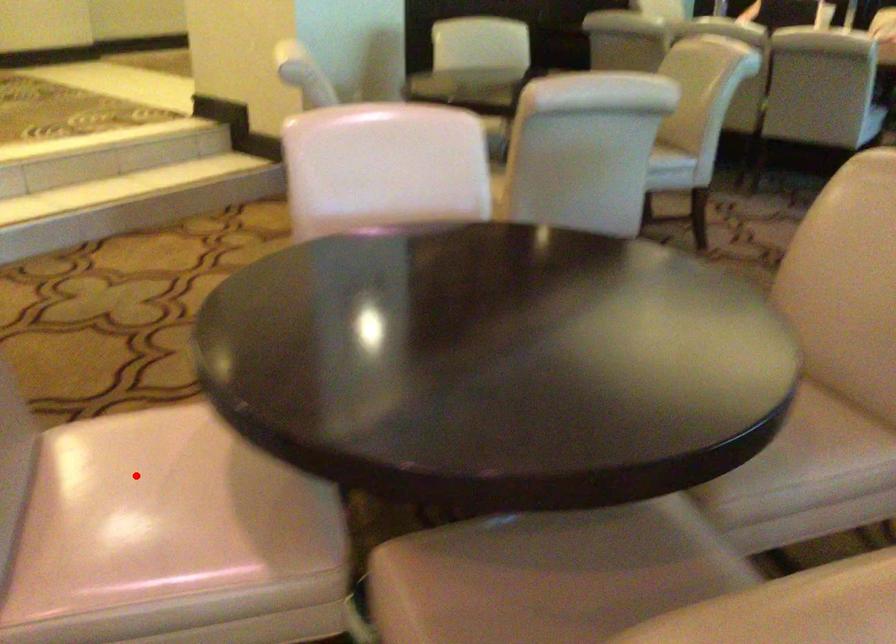
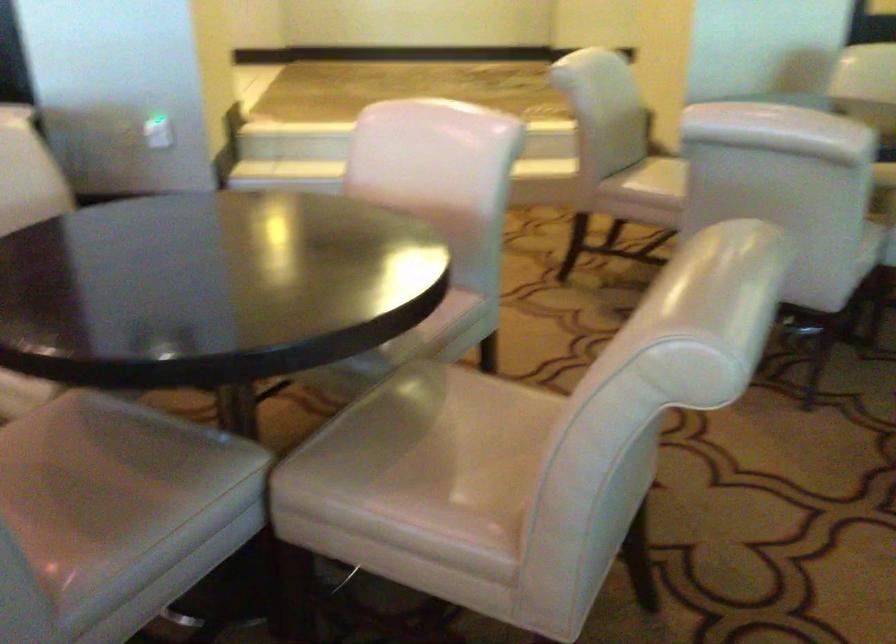
Question: I am providing you with two images of the same scene from different viewpoints. A red point is marked on the first image. Can you still see the location of the red point in image 2?

Choices:
 (A) Yes
 (B) No

Answer: (B)